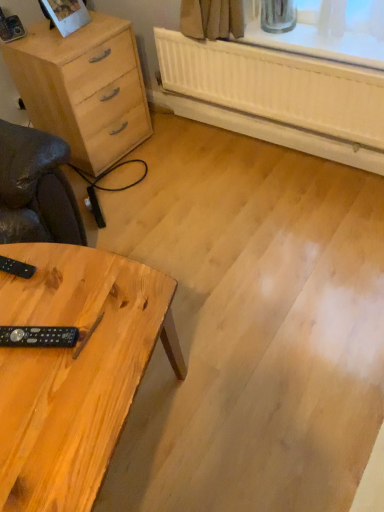
Locate an element on the screen. vacant point to the right of black plastic remote at lower left, marked as the 2th control in a front-to-back arrangement is located at coordinates [x=67, y=273].